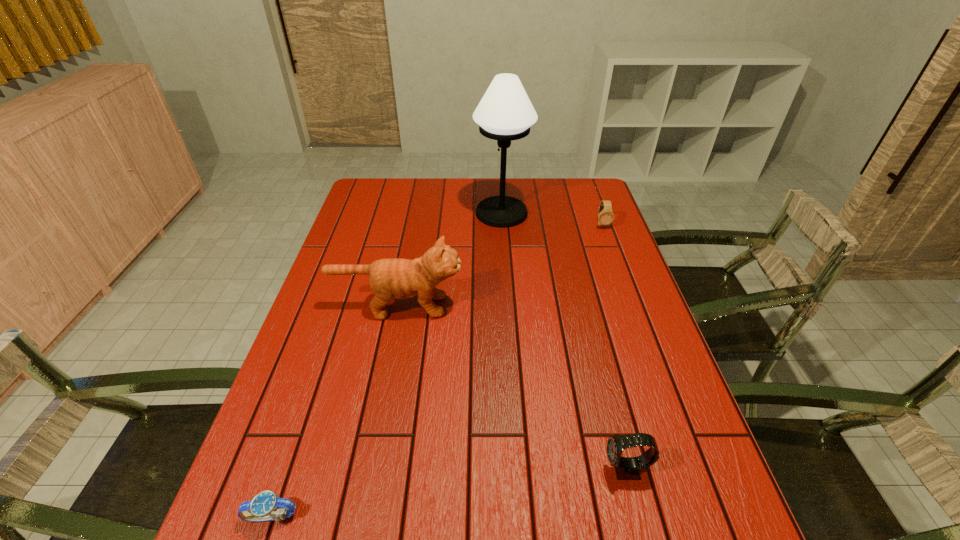
Find the location of `free location located on the front of the tallest object`. free location located on the front of the tallest object is located at coordinates (508, 305).

What are the coordinates of `vacant region located on the face of the cat` in the screenshot? It's located at (573, 306).

Identify the location of vacant space located 0.240m on the face of the second nearest object. Image resolution: width=960 pixels, height=540 pixels. (483, 470).

Image resolution: width=960 pixels, height=540 pixels. Identify the location of vacant space located on the face of the second nearest object. (419, 470).

Where is `free spot located on the face of the second nearest object`? free spot located on the face of the second nearest object is located at coordinates (453, 470).

Identify the location of vacant space located 0.400m on the face of the second shortest watch. (635, 313).

What are the coordinates of `vacant space located on the back of the shortest watch` in the screenshot? It's located at (293, 454).

Find the location of `object that is at the far edge`. object that is at the far edge is located at coordinates (505, 113).

Locate an element on the screen. The width and height of the screenshot is (960, 540). cat present at the left edge is located at coordinates (396, 278).

Where is `watch that is positioned at the left edge`? The width and height of the screenshot is (960, 540). watch that is positioned at the left edge is located at coordinates (260, 508).